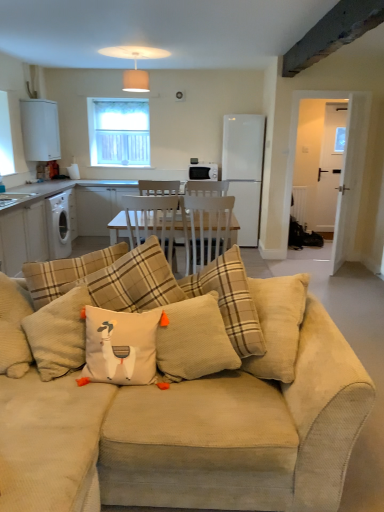
Question: Can you confirm if clear glass window at upper center is smaller than beige corduroy pillow at center, marked as the first pillow in a left-to-right arrangement?

Choices:
 (A) no
 (B) yes

Answer: (B)

Question: Is clear glass window at upper center looking in the opposite direction of beige corduroy pillow at center, marked as the first pillow in a left-to-right arrangement?

Choices:
 (A) no
 (B) yes

Answer: (A)

Question: Is beige corduroy pillow at center, marked as the first pillow in a left-to-right arrangement, surrounded by clear glass window at upper center?

Choices:
 (A) yes
 (B) no

Answer: (B)

Question: Is clear glass window at upper center positioned in front of beige corduroy pillow at center, which appears as the 2th pillow when viewed from the right?

Choices:
 (A) no
 (B) yes

Answer: (A)

Question: Is clear glass window at upper center bigger than beige corduroy pillow at center, which appears as the 2th pillow when viewed from the right?

Choices:
 (A) yes
 (B) no

Answer: (B)

Question: Looking at their shapes, would you say white textured cushion at center, arranged as the second pillow when viewed from the left, is wider or thinner than dark gray concrete beam at upper right?

Choices:
 (A) thin
 (B) wide

Answer: (A)

Question: From the image's perspective, is white textured cushion at center, the first pillow from the right, positioned above or below dark gray concrete beam at upper right?

Choices:
 (A) below
 (B) above

Answer: (A)

Question: Considering the positions of white textured cushion at center, arranged as the second pillow when viewed from the left, and dark gray concrete beam at upper right in the image, is white textured cushion at center, arranged as the second pillow when viewed from the left, bigger or smaller than dark gray concrete beam at upper right?

Choices:
 (A) big
 (B) small

Answer: (A)

Question: Is point (177, 309) closer or farther from the camera than point (286, 62)?

Choices:
 (A) closer
 (B) farther

Answer: (A)

Question: Is beige corduroy couch at center in front of or behind white textured cushion at center, arranged as the second pillow when viewed from the left, in the image?

Choices:
 (A) behind
 (B) front

Answer: (B)

Question: Is beige corduroy couch at center wider or thinner than white textured cushion at center, the first pillow from the right?

Choices:
 (A) thin
 (B) wide

Answer: (B)

Question: From the image's perspective, is beige corduroy couch at center located above or below white textured cushion at center, arranged as the second pillow when viewed from the left?

Choices:
 (A) below
 (B) above

Answer: (A)

Question: In terms of height, does beige corduroy couch at center look taller or shorter compared to white textured cushion at center, arranged as the second pillow when viewed from the left?

Choices:
 (A) short
 (B) tall

Answer: (B)

Question: Would you say beige corduroy couch at center is to the left or to the right of white glossy sink at left in the picture?

Choices:
 (A) right
 (B) left

Answer: (A)

Question: From the image's perspective, is beige corduroy couch at center positioned above or below white glossy sink at left?

Choices:
 (A) below
 (B) above

Answer: (A)